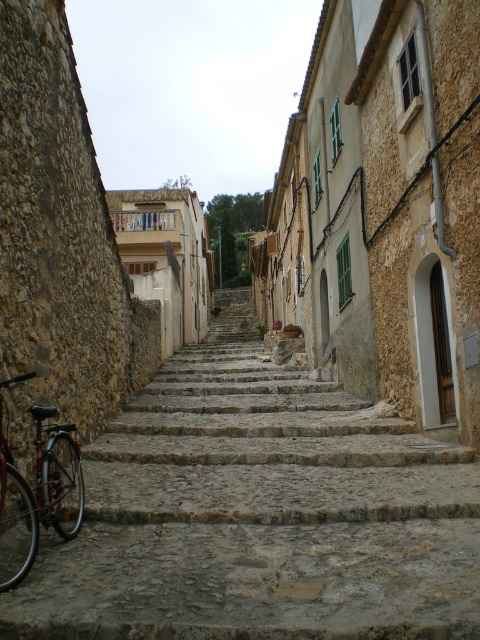
You are a tourist trying to take a photo of the shiny metallic bicycle at left and the stone steps at center from the street. Which object will appear bigger in your photo?

The stone steps at center will appear bigger in the photo because they have a larger size compared to the shiny metallic bicycle at left.

You are a tour guide leading a group up the narrow cobblestone street. You want to ensure everyone can walk comfortably between the stone steps at center and the shiny metallic bicycle at left. The average width of a person is 0.5 feet. Can the group walk through this space without difficulty?

The distance between the stone steps at center and the shiny metallic bicycle at left is 9.78 feet. Since the average width of a person is 0.5 feet, the group can comfortably walk through the space as the distance is more than sufficient for their movement.